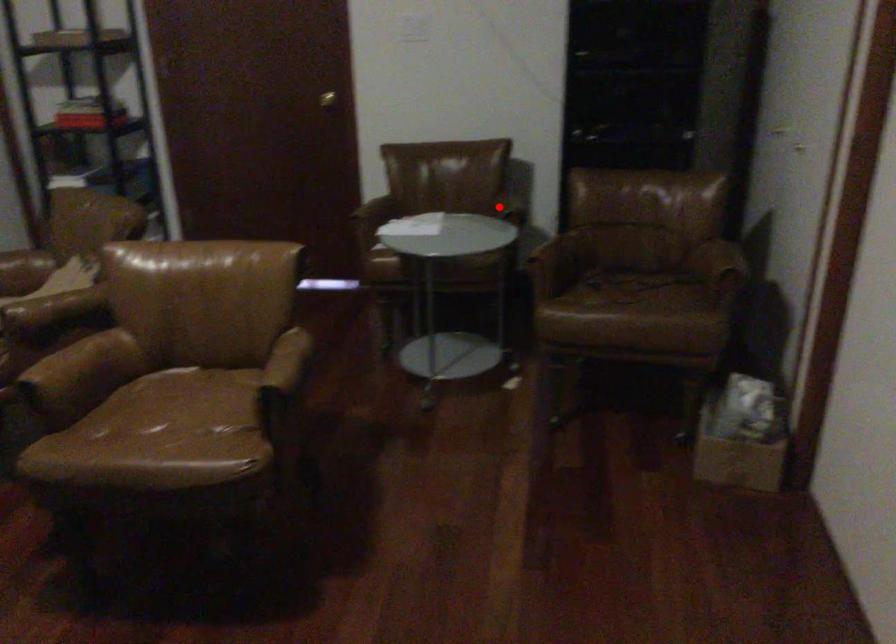
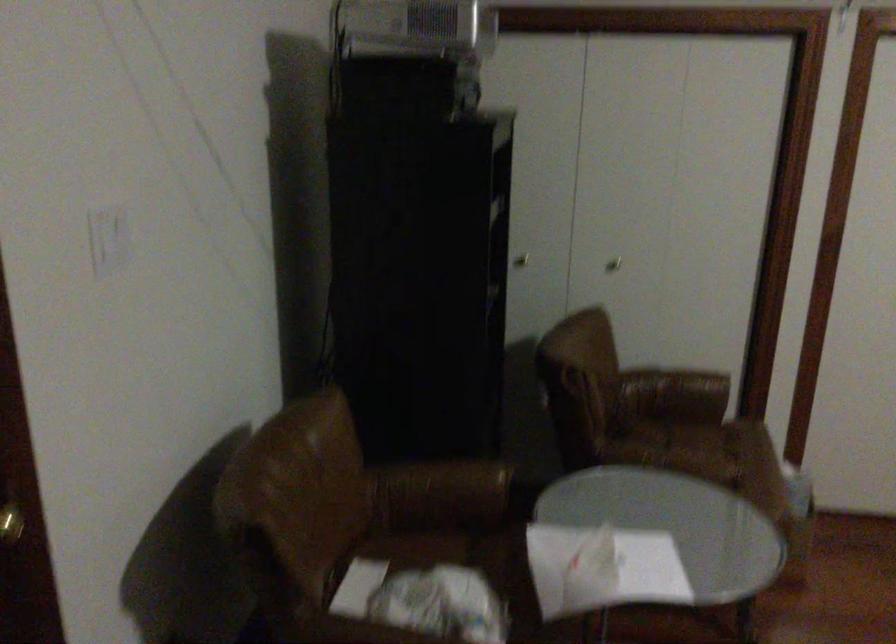
Question: I am providing you with two images of the same scene from different viewpoints. Image1 has a red point marked. In image2, the corresponding 3D location appears at what relative position? Reply with the corresponding letter.

Choices:
 (A) Closer
 (B) Farther

Answer: (A)